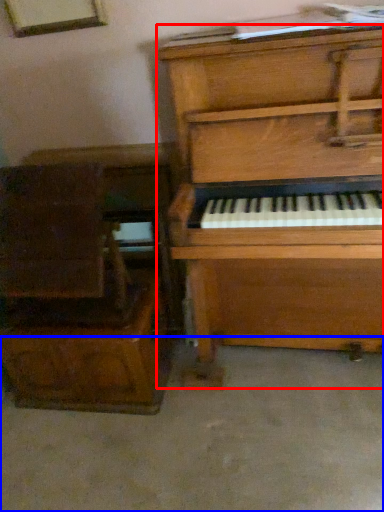
Question: Among these objects, which one is farthest to the camera, piano (highlighted by a red box) or concrete (highlighted by a blue box)?

Choices:
 (A) piano
 (B) concrete

Answer: (B)